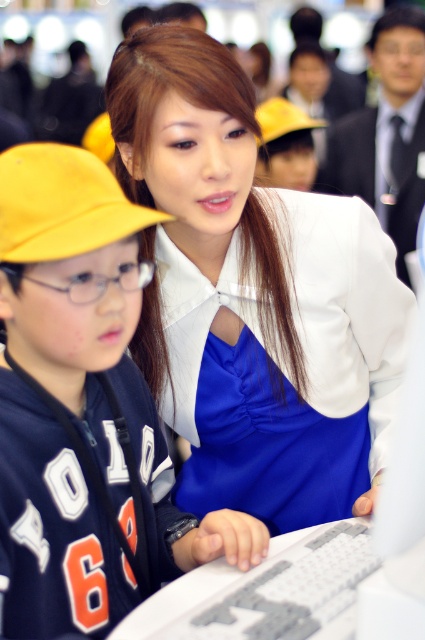
You are a photographer at the event and want to capture a photo of the satin blue dress at center and the matte yellow cap at left without any overlap between them. Given that your camera has a minimum focus distance of 12 inches, can you position yourself to take this shot?

The distance between the satin blue dress at center and the matte yellow cap at left is 12.20 inches. Since this is just over the camera minimum focus distance of 12 inches, you can position yourself to take the shot without overlap.

You are standing at the origin point in the image. There are two points marked in the scene. Which of the two points, point (90, 154) or point (54, 164), is closer to you?

Point (54, 164) is closer to you because it is in front of point (90, 154).

Looking at this image, you are standing at the center of the image. Which direction should you move to get closer to the matte yellow cap at left?

Since the matte yellow cap at left is located at coordinates approximately 0.641 on the x axis and 0.195 on the y axis, moving towards the left and slightly downward would bring you closer to the matte yellow cap at left.